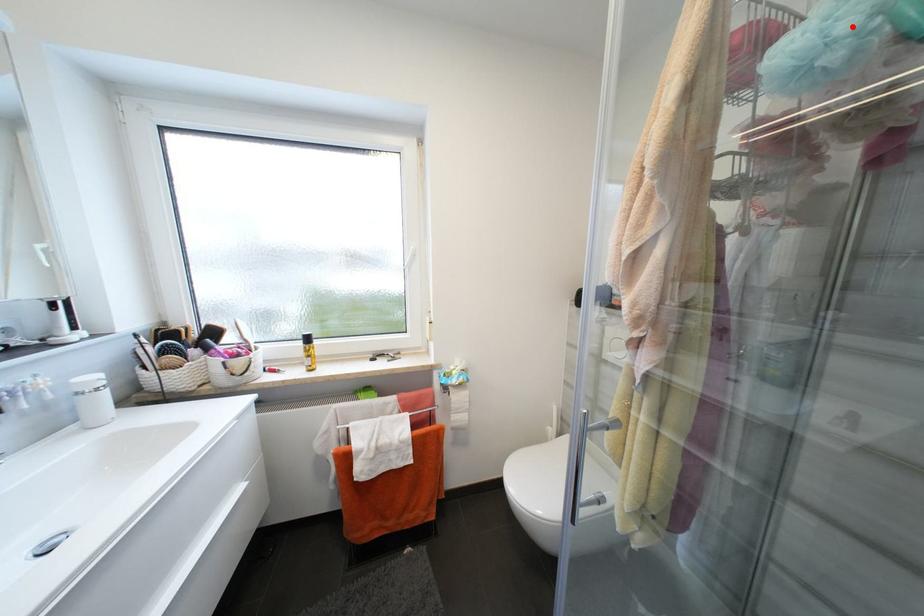
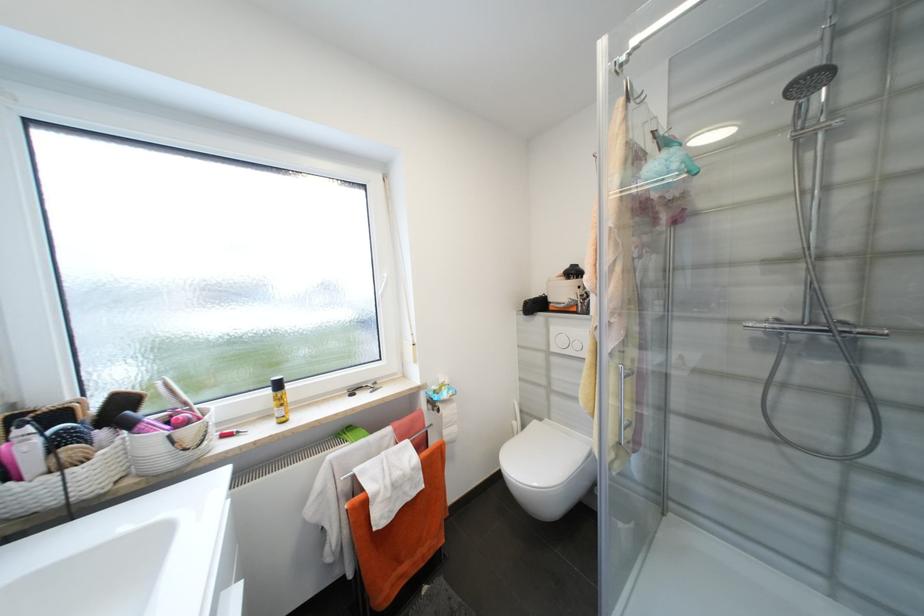
Question: I am providing you with two images of the same scene from different viewpoints. A red point is shown in image1. For the corresponding object point in image2, is it positioned nearer or farther from the camera?

Choices:
 (A) Nearer
 (B) Farther

Answer: (A)